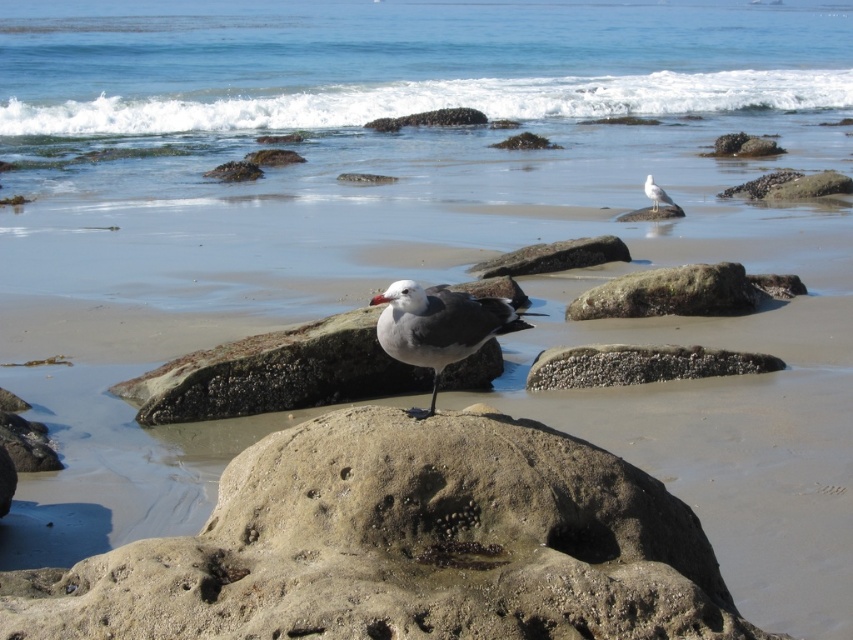
You are a photographer trying to capture the gray matte seagull at center and the smooth sandstone rock at center in a single frame. Based on their positions, which object is located to the left of the other?

The gray matte seagull at center is positioned on the left side of smooth sandstone rock at center.

Based on the photo, you are standing at the center of the beach scene and want to locate the blue water at upper center. According to the coordinates provided, where exactly would you look?

The blue water at upper center is located at coordinates point 0.133 on the x axis and 0.477 on the y axis.

You are standing on the beach and want to walk to the smooth gray rock at center. Which direction should you move to get closer to it without going into the blue water at upper center?

You should move away from the blue water at upper center because the smooth gray rock at center is behind it from your perspective.